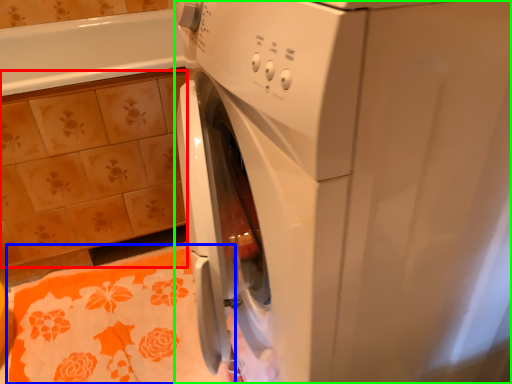
Question: Which object is the closest to the ceramic tile (highlighted by a red box)? Choose among these: bath towel (highlighted by a blue box) or washing machine (highlighted by a green box).

Choices:
 (A) bath towel
 (B) washing machine

Answer: (A)